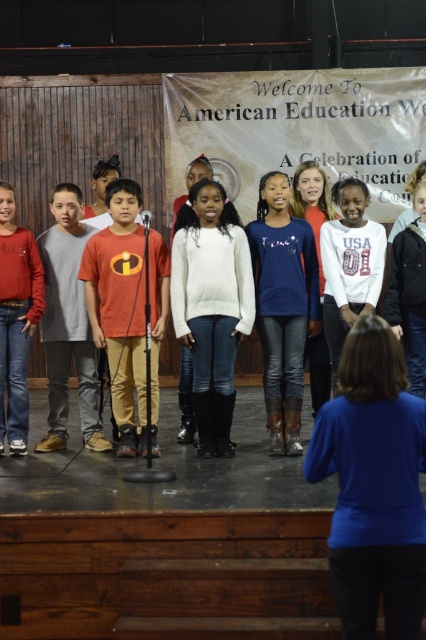
You are a photographer trying to capture a group photo of the children on stage. You notice the blue denim jeans at center and the orange cotton shirt at center. Which clothing item should you focus on first to ensure it fits within the frame, considering their widths?

The blue denim jeans at center has a lesser width compared to orange cotton shirt at center, so you should focus on capturing the orange cotton shirt at center first since it is wider and might require more attention to fit properly within the frame.

From the picture: You are a photographer positioned at the back of the stage. You need to capture a photo where both the blue denim jeans at center and the matte red sweater at left are in focus. Given that your camera can only sharply focus on objects within a 5 feet range, will you be able to achieve this?

The blue denim jeans at center and the matte red sweater at left are 8.57 feet apart from each other, which exceeds the camera focus range of 5 feet. Therefore, you cannot capture both in focus simultaneously.

You are a photographer trying to capture a clear shot of both the matte orange shirt at center and the white matte sweater at center during the performance. Since you want both subjects to be fully visible in the photo, which clothing item should you focus on adjusting the camera angle for to ensure it doesn not block the other?

The matte orange shirt at center is taller than the white matte sweater at center. To ensure both are fully visible, adjust the camera angle so that the taller matte orange shirt at center does not block the view of the shorter white matte sweater at center.